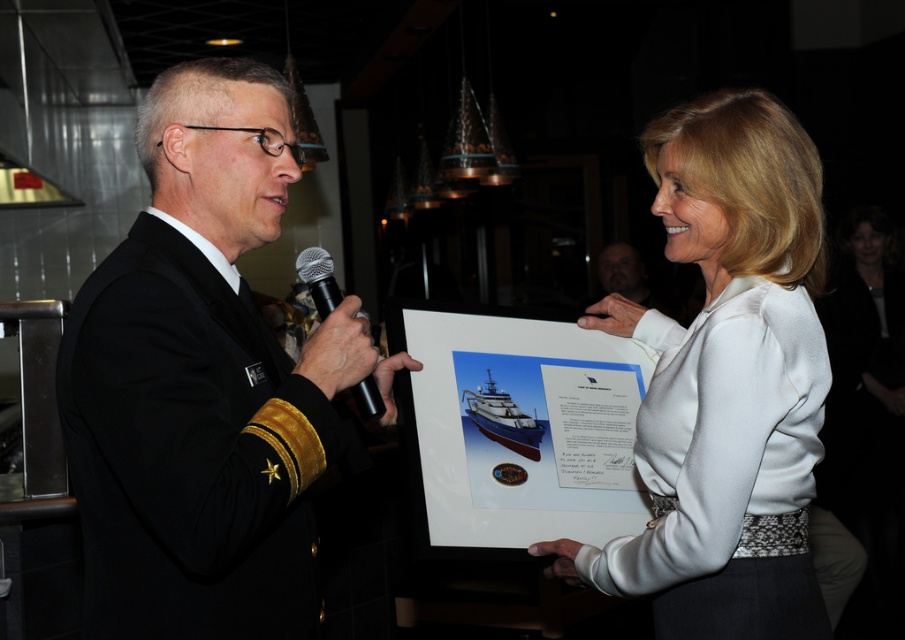
Is black uniform at left positioned before black metallic microphone at center?

That is True.

Can you confirm if black uniform at left is thinner than black metallic microphone at center?

Incorrect, black uniform at left's width is not less than black metallic microphone at center's.

What do you see at coordinates (205, 381) in the screenshot? I see `black uniform at left` at bounding box center [205, 381].

Find the location of a particular element. The width and height of the screenshot is (905, 640). black uniform at left is located at coordinates (205, 381).

Does white satin blouse at center come in front of black metallic microphone at center?

Yes, white satin blouse at center is closer to the viewer.

Can you confirm if white satin blouse at center is positioned above black metallic microphone at center?

No.

Who is more forward, (x=703, y=385) or (x=322, y=296)?

Point (x=703, y=385) is more forward.

At what (x,y) coordinates should I click in order to perform the action: click on white satin blouse at center. Please return your answer as a coordinate pair (x, y). This screenshot has width=905, height=640. Looking at the image, I should click on (726, 381).

Can you confirm if black metallic microphone at center is shorter than dark brown leather jacket at upper center?

Yes.

At what (x,y) coordinates should I click in order to perform the action: click on black metallic microphone at center. Please return your answer as a coordinate pair (x, y). Looking at the image, I should click on (318, 280).

Identify the location of black metallic microphone at center. (318, 280).